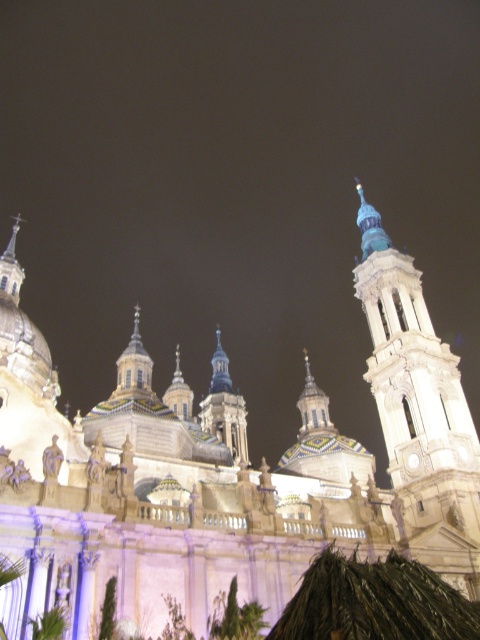
You are standing in front of the grand architectural structure and want to locate the point at coordinates [419,410]. Based on the description, which part of the structure should you look at?

The point at coordinates [419,410] is located on the white stone tower at right.

You are standing in front of the grand architectural structure described. You notice both the white stone church at center and the blue glass dome at center. Which object would appear larger to you based on their positions?

The white stone church at center is closer to the viewer than the blue glass dome at center, so it would appear larger.